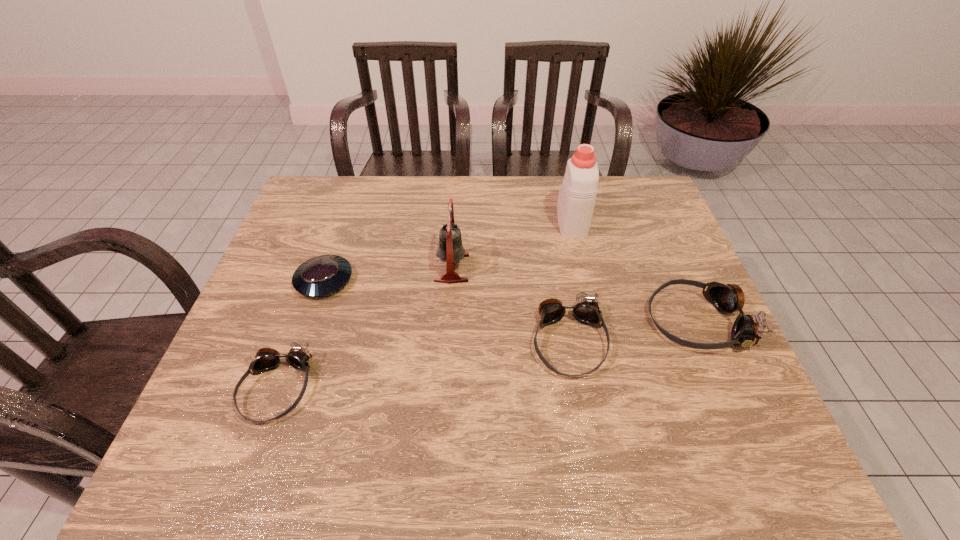
Find the location of `object that stands as the second closest to the third object from left to right`. object that stands as the second closest to the third object from left to right is located at coordinates (323, 275).

Choose which object is the third nearest neighbor to the rightmost object. Please provide its 2D coordinates. Your answer should be formatted as a tuple, i.e. [(x, y)], where the tuple contains the x and y coordinates of a point satisfying the conditions above.

[(450, 249)]

Locate which goggles is the closest to the shortest goggles. Please provide its 2D coordinates. Your answer should be formatted as a tuple, i.e. [(x, y)], where the tuple contains the x and y coordinates of a point satisfying the conditions above.

[(586, 310)]

The height and width of the screenshot is (540, 960). What are the coordinates of `the second closest goggles to the rightmost goggles` in the screenshot? It's located at (266, 359).

Where is `free point that satisfies the following two spatial constraints: 1. through the lenses of the rightmost goggles; 2. through the lenses of the second goggles from left to right`? free point that satisfies the following two spatial constraints: 1. through the lenses of the rightmost goggles; 2. through the lenses of the second goggles from left to right is located at coordinates (706, 342).